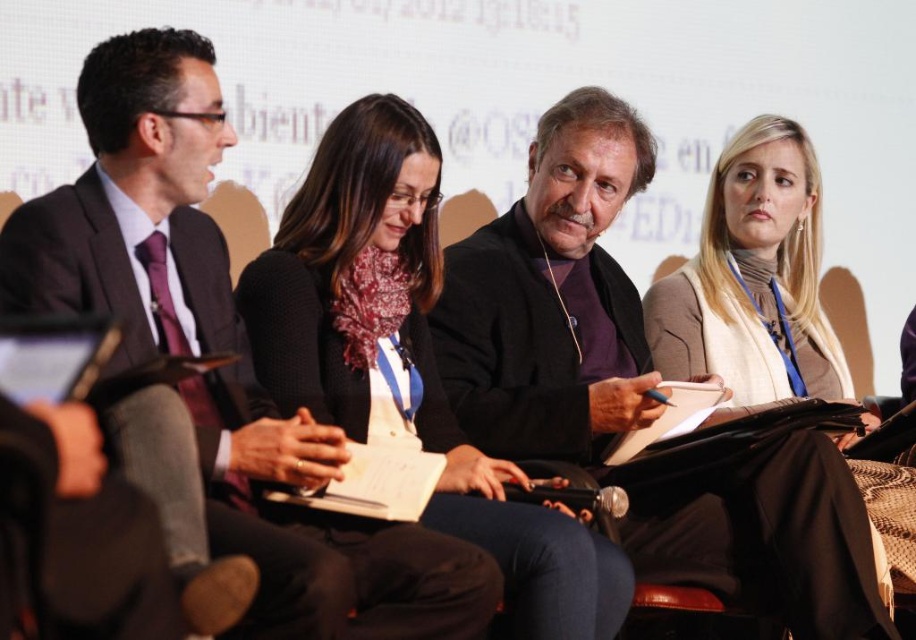
Question: Estimate the real-world distances between objects in this image. Which object is closer to the blonde hair scarf at upper right?

Choices:
 (A) matte black suit at left
 (B) dark brown leather jacket at center
 (C) black matte scarf at center

Answer: (B)

Question: Can you confirm if matte black suit at left is bigger than black matte scarf at center?

Choices:
 (A) no
 (B) yes

Answer: (A)

Question: Among these points, which one is nearest to the camera?

Choices:
 (A) [721, 497]
 (B) [743, 365]

Answer: (A)

Question: Is dark brown leather jacket at center to the right of black matte scarf at center from the viewer's perspective?

Choices:
 (A) yes
 (B) no

Answer: (A)

Question: Does matte black suit at left appear on the left side of blonde hair scarf at upper right?

Choices:
 (A) no
 (B) yes

Answer: (B)

Question: Which point is closer to the camera taking this photo?

Choices:
 (A) (826, 573)
 (B) (549, 529)
 (C) (649, 337)

Answer: (B)